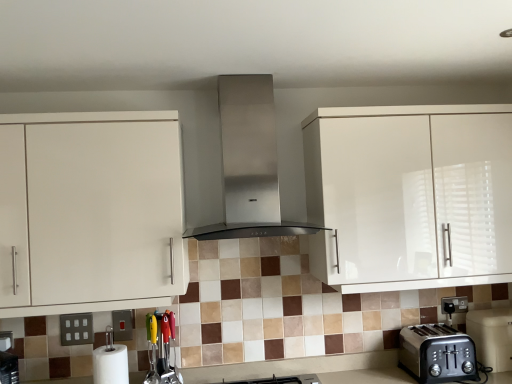
Question: From a real-world perspective, is white matte paper towel at lower left physically above white glossy cabinet at left, arranged as the 2th cabinetry when viewed from the right?

Choices:
 (A) no
 (B) yes

Answer: (A)

Question: Is white matte paper towel at lower left in front of white glossy cabinet at left, arranged as the 2th cabinetry when viewed from the right?

Choices:
 (A) yes
 (B) no

Answer: (B)

Question: Is white matte paper towel at lower left turned away from white glossy cabinet at left, the 1th cabinetry positioned from the left?

Choices:
 (A) no
 (B) yes

Answer: (A)

Question: Considering the relative sizes of white matte paper towel at lower left and white glossy cabinet at left, arranged as the 2th cabinetry when viewed from the right, in the image provided, is white matte paper towel at lower left wider than white glossy cabinet at left, arranged as the 2th cabinetry when viewed from the right,?

Choices:
 (A) no
 (B) yes

Answer: (A)

Question: Is white matte paper towel at lower left behind white glossy cabinet at left, arranged as the 2th cabinetry when viewed from the right?

Choices:
 (A) yes
 (B) no

Answer: (A)

Question: From the image's perspective, is multicolored plastic utensils at lower center, which is the 2th appliance from right to left, positioned above or below satin silver outlet at lower left?

Choices:
 (A) above
 (B) below

Answer: (B)

Question: Choose the correct answer: Is multicolored plastic utensils at lower center, which is the 2th appliance from right to left, inside satin silver outlet at lower left or outside it?

Choices:
 (A) outside
 (B) inside

Answer: (A)

Question: Considering the positions of multicolored plastic utensils at lower center, positioned as the first appliance in left-to-right order, and satin silver outlet at lower left in the image, is multicolored plastic utensils at lower center, positioned as the first appliance in left-to-right order, wider or thinner than satin silver outlet at lower left?

Choices:
 (A) thin
 (B) wide

Answer: (B)

Question: Considering the positions of point (160, 314) and point (75, 337), is point (160, 314) closer or farther from the camera than point (75, 337)?

Choices:
 (A) closer
 (B) farther

Answer: (A)

Question: Is matte black toaster at lower right wider or thinner than brushed metal switch at lower left?

Choices:
 (A) wide
 (B) thin

Answer: (A)

Question: Is matte black toaster at lower right taller or shorter than brushed metal switch at lower left?

Choices:
 (A) tall
 (B) short

Answer: (A)

Question: From a real-world perspective, is matte black toaster at lower right physically located above or below brushed metal switch at lower left?

Choices:
 (A) below
 (B) above

Answer: (A)

Question: Based on their sizes in the image, would you say matte black toaster at lower right is bigger or smaller than brushed metal switch at lower left?

Choices:
 (A) small
 (B) big

Answer: (B)

Question: Considering the relative positions of brushed metal switch at lower left and stainless steel range hood at center in the image provided, is brushed metal switch at lower left to the left or to the right of stainless steel range hood at center?

Choices:
 (A) right
 (B) left

Answer: (B)

Question: In the image, is brushed metal switch at lower left positioned in front of or behind stainless steel range hood at center?

Choices:
 (A) front
 (B) behind

Answer: (B)